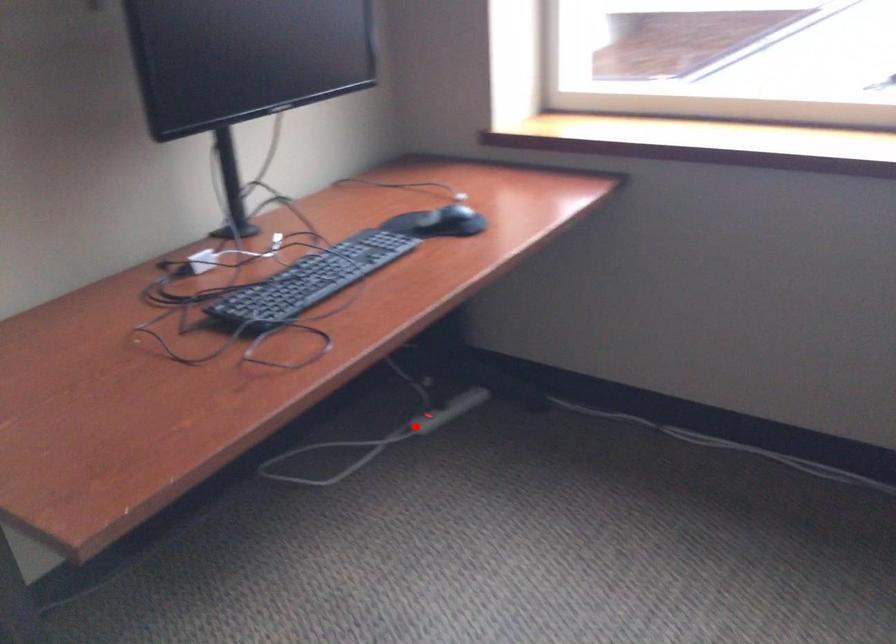
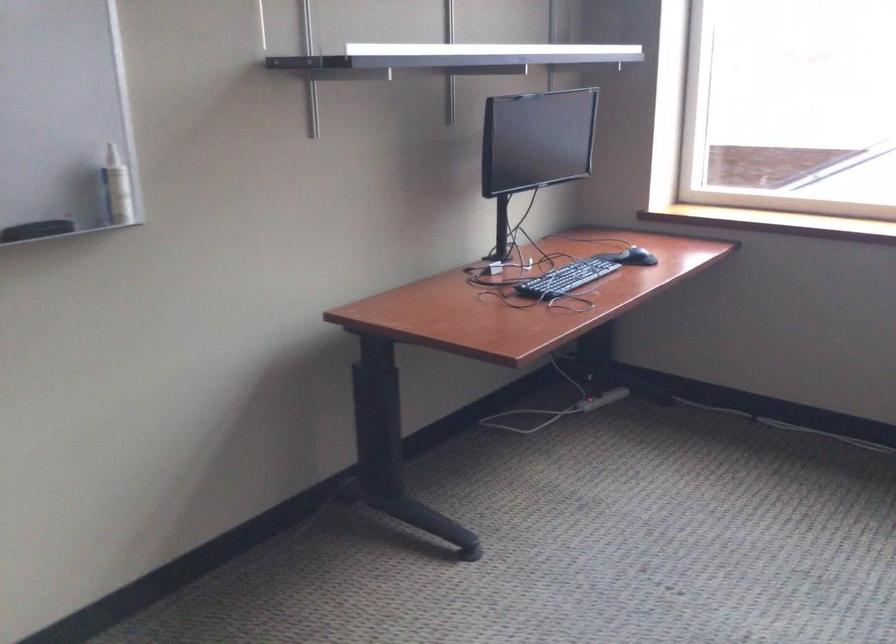
The point at the highlighted location is marked in the first image. Where is the corresponding point in the second image?

(587, 404)